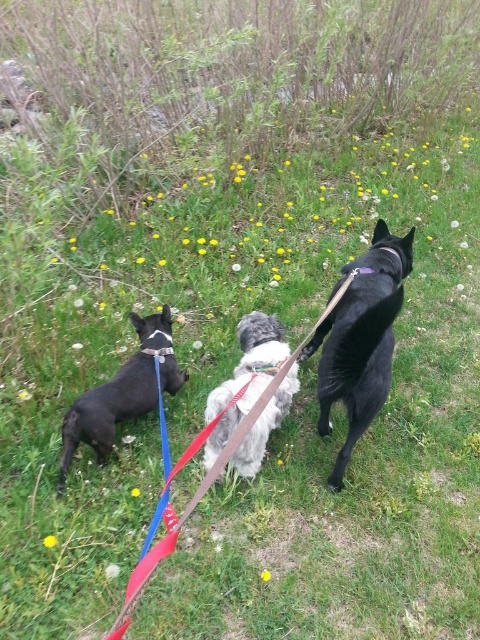
Who is higher up, shiny black dog at left or fluffy white dog at center?

fluffy white dog at center is above.

Is shiny black dog at left shorter than fluffy white dog at center?

In fact, shiny black dog at left may be taller than fluffy white dog at center.

Is point (113, 406) behind point (275, 352)?

No, it is not.

Where is `shiny black dog at left`? Image resolution: width=480 pixels, height=640 pixels. shiny black dog at left is located at coordinates (121, 394).

Does point (340, 346) come in front of point (187, 371)?

Yes, point (340, 346) is in front of point (187, 371).

Does shiny black dog at right have a greater width compared to shiny black dog at left?

Indeed, shiny black dog at right has a greater width compared to shiny black dog at left.

At what (x,y) coordinates should I click in order to perform the action: click on shiny black dog at right. Please return your answer as a coordinate pair (x, y). The height and width of the screenshot is (640, 480). Looking at the image, I should click on (360, 339).

Locate an element on the screen. shiny black dog at right is located at coordinates (360, 339).

Consider the image. Who is positioned more to the right, shiny black dog at left or brown leather leash at center?

brown leather leash at center

Is shiny black dog at left shorter than brown leather leash at center?

Yes, shiny black dog at left is shorter than brown leather leash at center.

This screenshot has width=480, height=640. What do you see at coordinates (121, 394) in the screenshot?
I see `shiny black dog at left` at bounding box center [121, 394].

You are a GUI agent. You are given a task and a screenshot of the screen. Output one action in this format:
    pyautogui.click(x=<x>, y=<y>)
    Task: Click on the shiny black dog at left
    This screenshot has height=640, width=480.
    Given the screenshot: What is the action you would take?
    pyautogui.click(x=121, y=394)